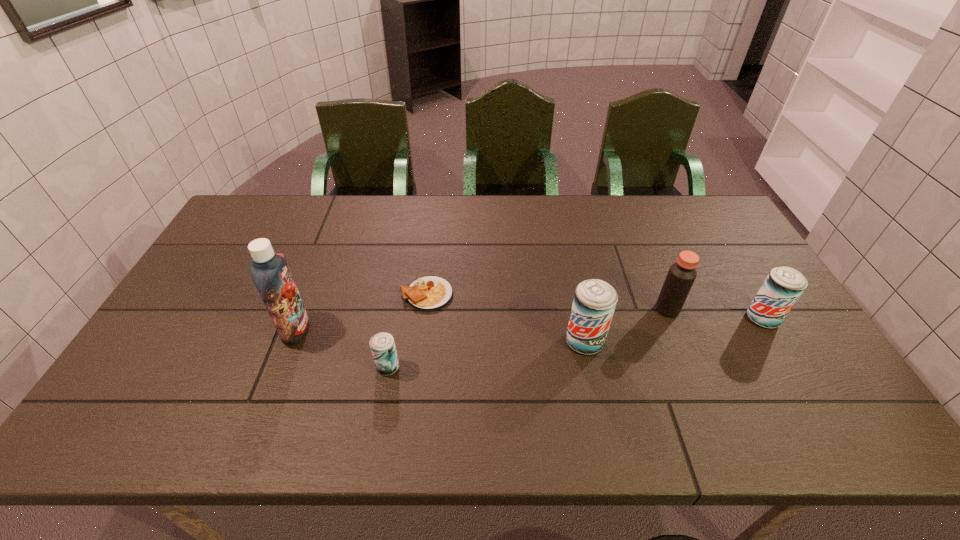
You are a GUI agent. You are given a task and a screenshot of the screen. Output one action in this format:
    pyautogui.click(x=<x>, y=<y>)
    Task: Click on the shortest beer can
    
    Given the screenshot: What is the action you would take?
    pyautogui.click(x=382, y=344)

This screenshot has height=540, width=960. Identify the location of the second shortest object. pos(382,344).

At what (x,y) coordinates should I click in order to perform the action: click on the fourth object from left to right. Please return your answer as a coordinate pair (x, y). The image size is (960, 540). Looking at the image, I should click on (594, 303).

Locate an element on the screen. the rightmost object is located at coordinates (783, 286).

I want to click on the second tallest beer can, so click(783, 286).

I want to click on shampoo, so click(x=270, y=272).

Find the location of a particular element. the leftmost object is located at coordinates (270, 272).

The image size is (960, 540). In order to click on omelet in this screenshot , I will do `click(428, 293)`.

You are a GUI agent. You are given a task and a screenshot of the screen. Output one action in this format:
    pyautogui.click(x=<x>, y=<y>)
    Task: Click on the fifth object from left to right
    This screenshot has height=540, width=960.
    Given the screenshot: What is the action you would take?
    pyautogui.click(x=681, y=275)

Locate an element on the screen. free space located 0.090m on the back of the leftmost beer can is located at coordinates (395, 330).